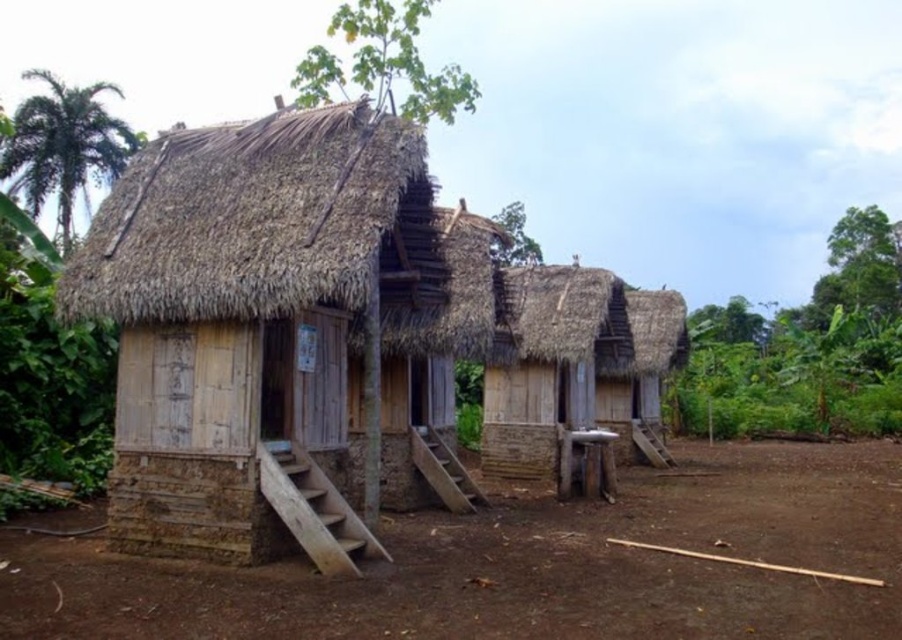
You are a visitor approaching the wooden hut at left and the thatched straw roof at upper left. Which structure is taller when viewed from the ground?

The thatched straw roof at upper left is taller than the wooden hut at left.

You are planning to plant a garden in the brown dirt field at lower center. Considering the height of the thatched straw roof at upper left, will the plants in the field grow tall enough to reach the roof?

The brown dirt field at lower center is not as tall as the thatched straw roof at upper left, so the plants in the field will not grow tall enough to reach the roof.